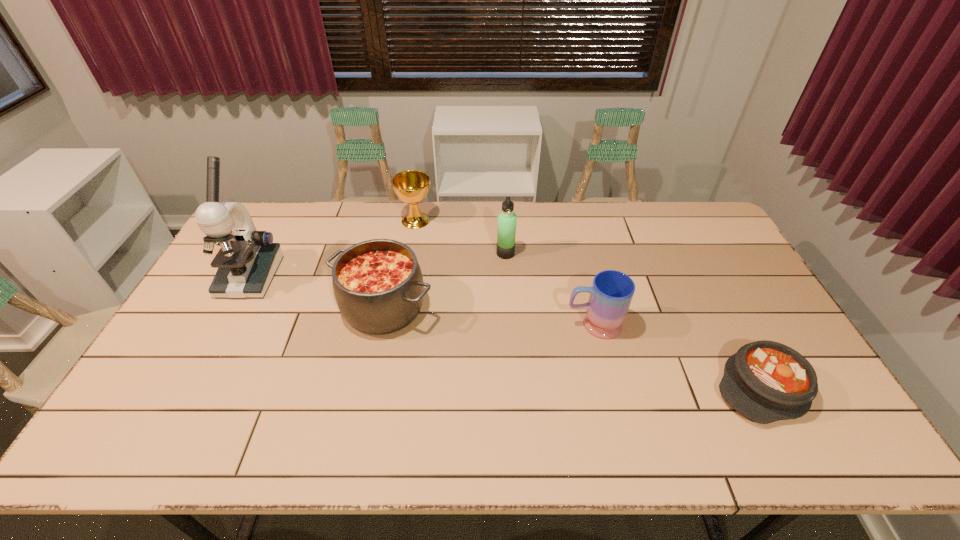
Locate an element on the screen. object located at the left edge is located at coordinates [x=248, y=259].

Identify the location of object that is positioned at the right edge. The width and height of the screenshot is (960, 540). (765, 381).

Locate an element on the screen. This screenshot has height=540, width=960. object located in the near right corner section of the desktop is located at coordinates (765, 381).

In the image, there is a desktop. Where is `vacant space at the far edge`? Image resolution: width=960 pixels, height=540 pixels. vacant space at the far edge is located at coordinates (327, 219).

The height and width of the screenshot is (540, 960). I want to click on vacant space at the near edge of the desktop, so click(459, 455).

At what (x,y) coordinates should I click in order to perform the action: click on vacant region at the left edge of the desktop. Please return your answer as a coordinate pair (x, y). The width and height of the screenshot is (960, 540). Looking at the image, I should click on (160, 370).

In the image, there is a desktop. Identify the location of free space at the near right corner. (837, 434).

Find the location of a particular element. Image resolution: width=960 pixels, height=540 pixels. unoccupied position between the farther casserole and the leftmost object is located at coordinates (317, 292).

Locate an element on the screen. The image size is (960, 540). vacant region between the thermos bottle and the chalice is located at coordinates (461, 237).

Image resolution: width=960 pixels, height=540 pixels. What are the coordinates of `free space between the fifth shortest object and the chalice` in the screenshot? It's located at (461, 237).